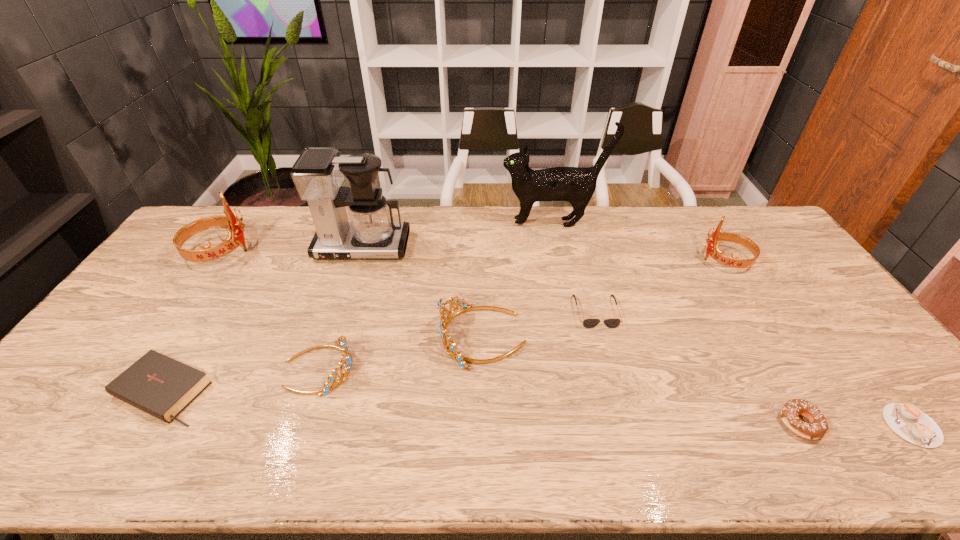
Where is `vacant space located on the front-facing side of the bigger red tiara`? The width and height of the screenshot is (960, 540). vacant space located on the front-facing side of the bigger red tiara is located at coordinates (296, 252).

Identify the location of free space located on the front-facing side of the third shortest tiara. pos(656,260).

I want to click on free space located 0.120m on the front-facing side of the third shortest tiara, so click(x=665, y=260).

Find the location of `vacant space positioned 0.390m on the front-facing side of the third shortest tiara`. vacant space positioned 0.390m on the front-facing side of the third shortest tiara is located at coordinates (585, 260).

Image resolution: width=960 pixels, height=540 pixels. I want to click on vacant region located on the front-facing side of the second shortest tiara, so click(x=323, y=337).

This screenshot has width=960, height=540. I want to click on vacant area situated on the front-facing side of the second shortest tiara, so click(397, 337).

This screenshot has height=540, width=960. I want to click on vacant area located on the front-facing side of the second shortest tiara, so click(x=323, y=337).

The image size is (960, 540). I want to click on vacant area situated on the front-facing side of the smaller gold tiara, so [460, 368].

At what (x,y) coordinates should I click in order to perform the action: click on free location located 0.070m on the front-facing side of the sunglasses. Please return your answer as a coordinate pair (x, y). This screenshot has height=540, width=960. Looking at the image, I should click on click(x=606, y=348).

Locate an element on the screen. vacant area situated on the right of the doughnut is located at coordinates (904, 423).